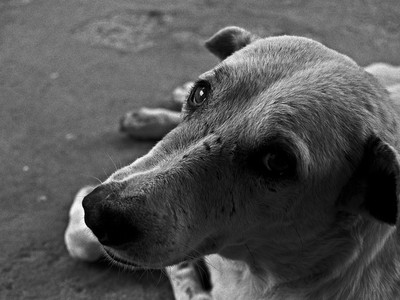
At what (x,y) coordinates should I click in order to perform the action: click on white spots in rug. Please return your answer as a coordinate pair (x, y). This screenshot has width=400, height=300. Looking at the image, I should click on (41, 197), (25, 165), (68, 137), (53, 71).